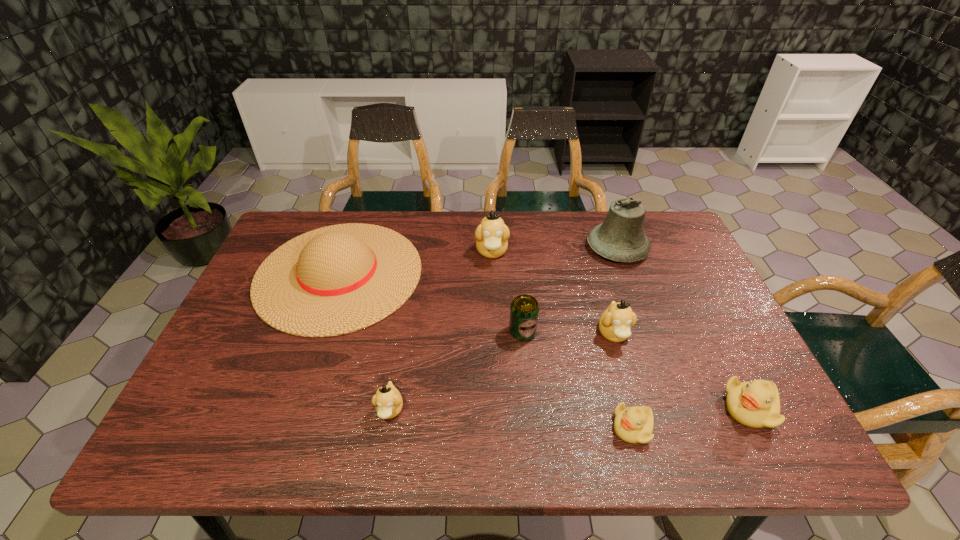
You are a GUI agent. You are given a task and a screenshot of the screen. Output one action in this format:
    pyautogui.click(x=<x>, y=<y>)
    Task: Click on the leftmost tan duckling
    This screenshot has width=960, height=540.
    Given the screenshot: What is the action you would take?
    (x=388, y=402)

The image size is (960, 540). What are the coordinates of `the shortest duckling` in the screenshot? It's located at (634, 424).

This screenshot has width=960, height=540. I want to click on the shortest object, so pos(634,424).

Find the location of `free region located on the right of the tallest object`. free region located on the right of the tallest object is located at coordinates (670, 248).

Identify the location of free spot located on the face of the second duckling from left to right. (492, 281).

At what (x,y) coordinates should I click in order to perform the action: click on free space located 0.070m on the right of the beige bonnet. Please return your answer as a coordinate pair (x, y). This screenshot has height=540, width=960. Looking at the image, I should click on (444, 274).

At what (x,y) coordinates should I click in order to perform the action: click on vacant position located 0.190m on the face of the rightmost tan duckling. Please return your answer as a coordinate pair (x, y). The width and height of the screenshot is (960, 540). Looking at the image, I should click on (639, 424).

Where is `vacant position located 0.070m on the right of the beer can`? vacant position located 0.070m on the right of the beer can is located at coordinates (564, 332).

I want to click on vacant space situated 0.290m on the front-facing side of the right yellow duckling, so click(x=593, y=408).

At what (x,y) coordinates should I click in order to perform the action: click on free space located 0.230m on the front-facing side of the right yellow duckling. Please return your answer as a coordinate pair (x, y). Looking at the image, I should click on (620, 408).